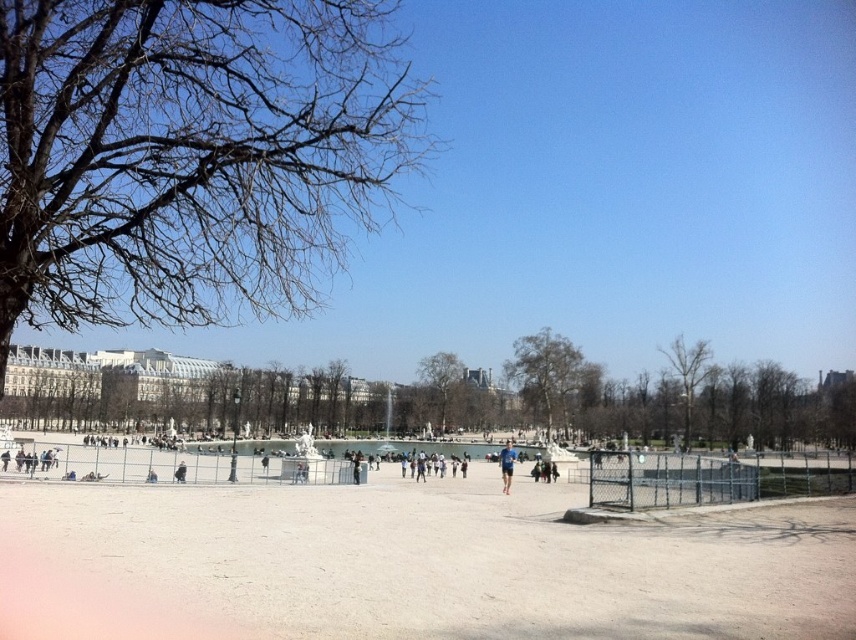
Question: From the image, what is the correct spatial relationship of bare wood tree at center in relation to brown textured tree at center?

Choices:
 (A) below
 (B) above

Answer: (B)

Question: Which point appears closest to the camera in this image?

Choices:
 (A) (545, 358)
 (B) (508, 456)
 (C) (94, 132)

Answer: (C)

Question: Among these objects, which one is farthest from the camera?

Choices:
 (A) brown textured tree at center
 (B) bare branches at upper left
 (C) blue fabric shirt at center

Answer: (A)

Question: Does bare wood tree at center have a larger size compared to blue fabric shirt at center?

Choices:
 (A) no
 (B) yes

Answer: (A)

Question: Does bare branches at upper left appear on the right side of bare wood tree at center?

Choices:
 (A) no
 (B) yes

Answer: (A)

Question: Which point is closer to the camera?

Choices:
 (A) bare wood tree at center
 (B) brown textured tree at center
 (C) green leafy tree at center
 (D) bare branches at upper left

Answer: (D)